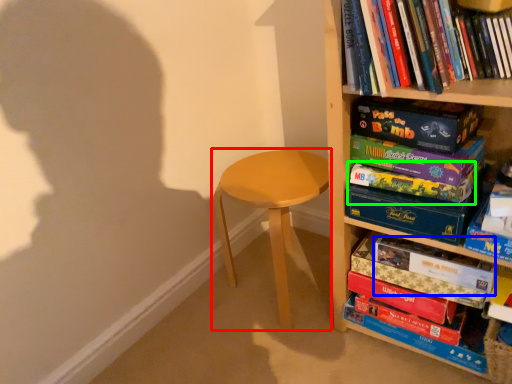
Question: Based on their relative distances, which object is farther from stool (highlighted by a red box)? Choose from paperback book (highlighted by a blue box) and paperback book (highlighted by a green box).

Choices:
 (A) paperback book
 (B) paperback book

Answer: (A)